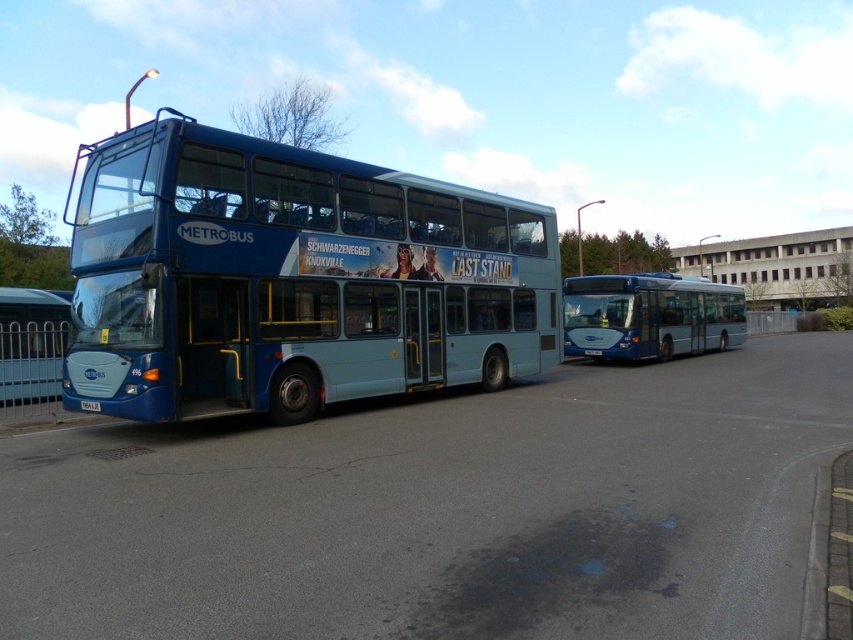
Is point (714, 317) in front of point (90, 401)?

That is False.

Which is behind, point (712, 308) or point (97, 412)?

Point (712, 308)

Is point (654, 300) farther from viewer compared to point (82, 410)?

Yes, point (654, 300) is behind point (82, 410).

Image resolution: width=853 pixels, height=640 pixels. What are the coordinates of `glossy blue bus at center` in the screenshot? It's located at (648, 316).

Which is above, blue metallic bus at center or white plastic license plate at center?

blue metallic bus at center

Can you confirm if blue metallic bus at center is positioned above white plastic license plate at center?

Yes, blue metallic bus at center is above white plastic license plate at center.

Between point (248, 182) and point (90, 406), which one is positioned in front?

Point (90, 406)

Where is `blue metallic bus at center`? Image resolution: width=853 pixels, height=640 pixels. blue metallic bus at center is located at coordinates (292, 280).

Who is positioned more to the left, blue metallic bus at center or glossy blue bus at center?

From the viewer's perspective, blue metallic bus at center appears more on the left side.

What are the coordinates of `blue metallic bus at center` in the screenshot? It's located at (292, 280).

Is point (253, 310) more distant than point (723, 337)?

No, (253, 310) is closer to viewer.

Locate an element on the screen. The image size is (853, 640). blue metallic bus at center is located at coordinates (292, 280).